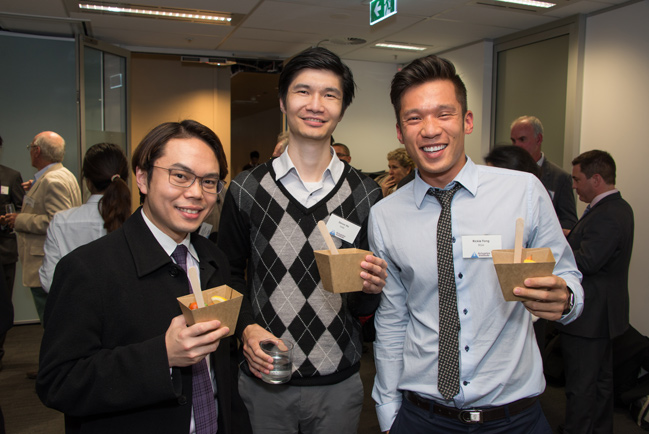
This screenshot has height=434, width=649. Find the location of `ceiling ligt`. ceiling ligt is located at coordinates (214, 24), (391, 44), (533, 3).